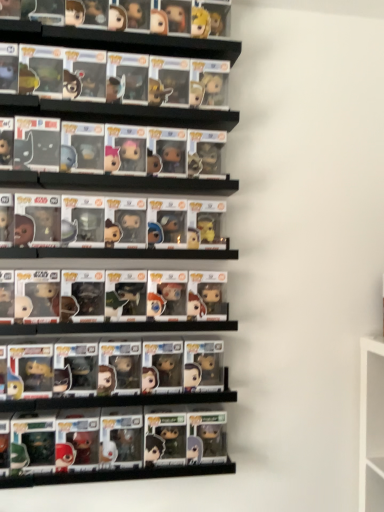
The width and height of the screenshot is (384, 512). What do you see at coordinates (131, 446) in the screenshot?
I see `shiny plastic figures at lower center` at bounding box center [131, 446].

Where is `shiny plastic figures at lower center`? This screenshot has width=384, height=512. shiny plastic figures at lower center is located at coordinates (131, 446).

Find the location of a particular element. The width and height of the screenshot is (384, 512). shiny plastic figures at lower center is located at coordinates (131, 446).